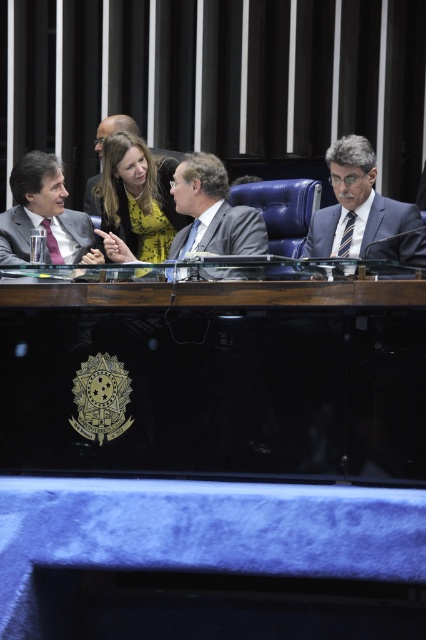
Is matte gray suit at center in front of dark gray suit at center?

No, it is not.

I want to click on matte gray suit at center, so click(213, 211).

Between point (206, 166) and point (238, 248), which one is positioned in front?

Point (238, 248) is in front.

This screenshot has width=426, height=640. I want to click on matte gray suit at center, so click(x=213, y=211).

Who is positioned more to the right, black polished wood table at center or dark blue suit at right?

dark blue suit at right is more to the right.

Can you confirm if black polished wood table at center is positioned to the right of dark blue suit at right?

No, black polished wood table at center is not to the right of dark blue suit at right.

Which is in front, point (118, 324) or point (319, 221)?

Point (118, 324)

Image resolution: width=426 pixels, height=640 pixels. I want to click on black polished wood table at center, so click(x=213, y=376).

Who is more distant from viewer, (226, 388) or (192, 230)?

Point (192, 230)

This screenshot has width=426, height=640. Describe the element at coordinates (213, 376) in the screenshot. I see `black polished wood table at center` at that location.

The height and width of the screenshot is (640, 426). I want to click on black polished wood table at center, so click(213, 376).